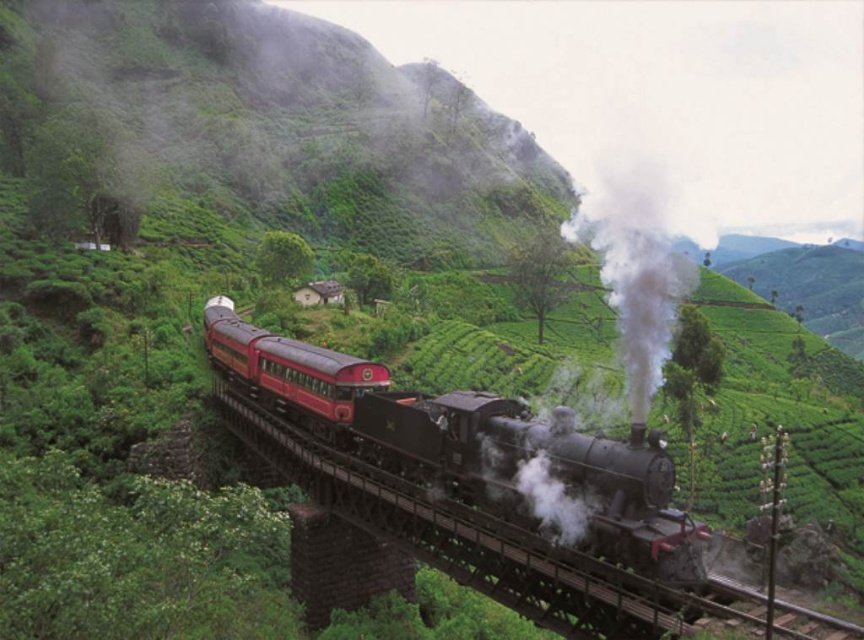
You are a photographer trying to capture the steam locomotive scene. You notice the polished black steam engine at center and the white matte smoke at center. Which object appears larger in the photo?

The white matte smoke at center appears larger than the polished black steam engine at center because the engine has a smaller size compared to the smoke.

You are standing on the platform waiting for the train to pass. The platform is 15 meters long. Can you safely walk to the end of the platform before the polished black steam engine at center arrives?

The polished black steam engine at center is 12.73 meters away from you. Since the platform is 15 meters long, you have enough time to walk to the end of the platform before the train arrives.

You are a train engineer observing the scene. You need to determine which object is taller between the polished black steam locomotive at center and the polished red passenger train at center. Which one is taller?

The polished black steam locomotive at center is taller than the polished red passenger train at center.